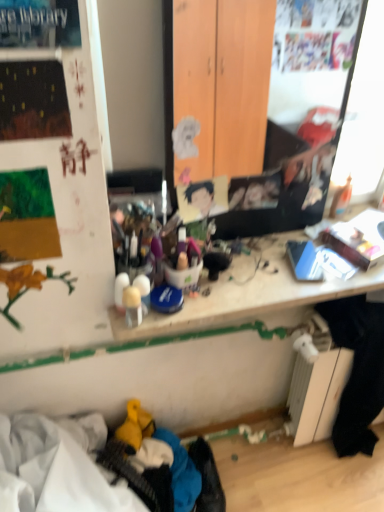
Describe the element at coordinates (203, 199) in the screenshot. I see `smooth cardboard portrait at center` at that location.

This screenshot has width=384, height=512. Identify the location of smooth cardboard portrait at center. (203, 199).

Which object is wider, wooden desk at center or black fabric at lower right?

Wider between the two is wooden desk at center.

From the image's perspective, would you say wooden desk at center is shown under black fabric at lower right?

Incorrect, from the image's perspective, wooden desk at center is higher than black fabric at lower right.

How much distance is there between wooden desk at center and black fabric at lower right?

10.81 inches.

The image size is (384, 512). What are the coordinates of `clothing below the wooden desk at center (from a real-world perspective)` in the screenshot? It's located at (358, 370).

Considering the sizes of objects black fabric at lower right and smooth cardboard portrait at center in the image provided, who is smaller, black fabric at lower right or smooth cardboard portrait at center?

smooth cardboard portrait at center.

Looking at this image, is black fabric at lower right shorter than smooth cardboard portrait at center?

No, black fabric at lower right is not shorter than smooth cardboard portrait at center.

Is black fabric at lower right wider or thinner than smooth cardboard portrait at center?

Considering their sizes, black fabric at lower right looks broader than smooth cardboard portrait at center.

Are black fabric at lower right and smooth cardboard portrait at center far apart?

No.

Which object is closer to the camera, smooth cardboard portrait at center or black fabric at lower right?

smooth cardboard portrait at center is more forward.

Based on the photo, can you tell me how much smooth cardboard portrait at center and black fabric at lower right differ in facing direction?

smooth cardboard portrait at center and black fabric at lower right are facing 5.27 degrees away from each other.

Which of these two, smooth cardboard portrait at center or black fabric at lower right, stands shorter?

smooth cardboard portrait at center.

Would you consider smooth cardboard portrait at center to be distant from black fabric at lower right?

No, smooth cardboard portrait at center is not far away from black fabric at lower right.

Can you confirm if wooden desk at center is wider than smooth cardboard portrait at center?

Yes.

Based on the photo, how much distance is there between wooden desk at center and smooth cardboard portrait at center?

27.38 centimeters.

Can you tell me how much wooden desk at center and smooth cardboard portrait at center differ in facing direction?

They differ by 4.37 degrees in their facing directions.

From the image's perspective, is wooden desk at center above or below smooth cardboard portrait at center?

wooden desk at center is below smooth cardboard portrait at center.

Which object is more forward, smooth cardboard portrait at center or wooden desk at center?

wooden desk at center is in front.

Is wooden desk at center a part of smooth cardboard portrait at center?

That's incorrect, wooden desk at center is not inside smooth cardboard portrait at center.

From a real-world perspective, which is physically below, smooth cardboard portrait at center or wooden desk at center?

wooden desk at center.

Which of these two, smooth cardboard portrait at center or wooden desk at center, stands shorter?

wooden desk at center.

I want to click on writing desk that appears in front of the black fabric at lower right, so click(x=245, y=298).

Which of these two, black fabric at lower right or wooden desk at center, is wider?

With larger width is wooden desk at center.

Is black fabric at lower right touching wooden desk at center?

No, black fabric at lower right is not in contact with wooden desk at center.

From a real-world perspective, is black fabric at lower right over wooden desk at center?

No, from a real-world perspective, black fabric at lower right is not on top of wooden desk at center.

Identify the location of writing desk above the black fabric at lower right (from a real-world perspective). (245, 298).

Locate an element on the screen. clothing below the smooth cardboard portrait at center (from the image's perspective) is located at coordinates (358, 370).

Based on their spatial positions, is smooth cardboard portrait at center or black fabric at lower right closer to wooden desk at center?

→ smooth cardboard portrait at center is closer to wooden desk at center.

Considering their positions, is wooden desk at center positioned further to smooth cardboard portrait at center than black fabric at lower right?

black fabric at lower right.

Based on the photo, looking at the image, which one is located closer to wooden desk at center, black fabric at lower right or smooth cardboard portrait at center?

smooth cardboard portrait at center.

Based on their spatial positions, is wooden desk at center or smooth cardboard portrait at center further from black fabric at lower right?

The object further to black fabric at lower right is smooth cardboard portrait at center.

From the image, which object appears to be nearer to black fabric at lower right, smooth cardboard portrait at center or wooden desk at center?

wooden desk at center lies closer to black fabric at lower right than the other object.

When comparing their distances from smooth cardboard portrait at center, does black fabric at lower right or wooden desk at center seem further?

Among the two, black fabric at lower right is located further to smooth cardboard portrait at center.

Locate an element on the screen. The image size is (384, 512). writing desk situated between smooth cardboard portrait at center and black fabric at lower right from left to right is located at coordinates (245, 298).